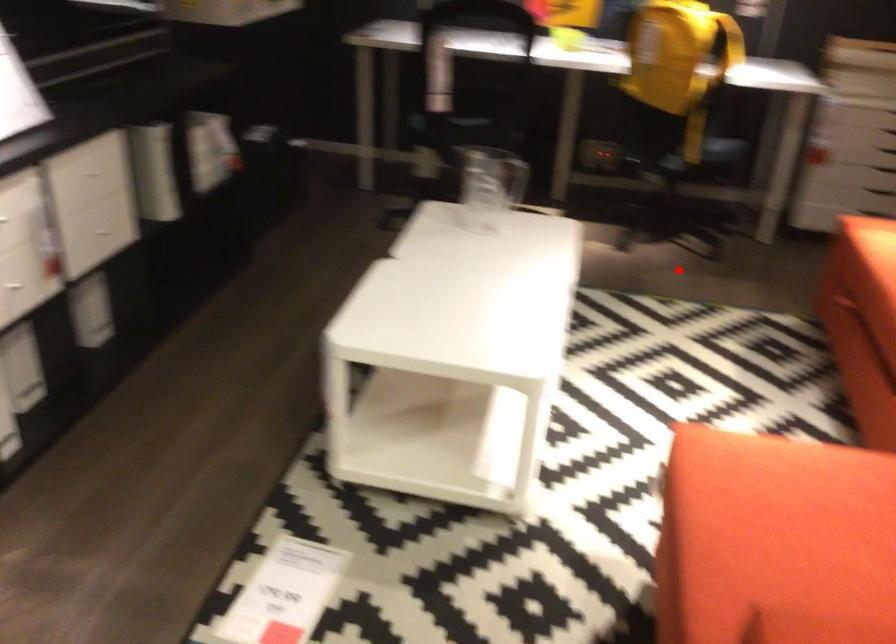
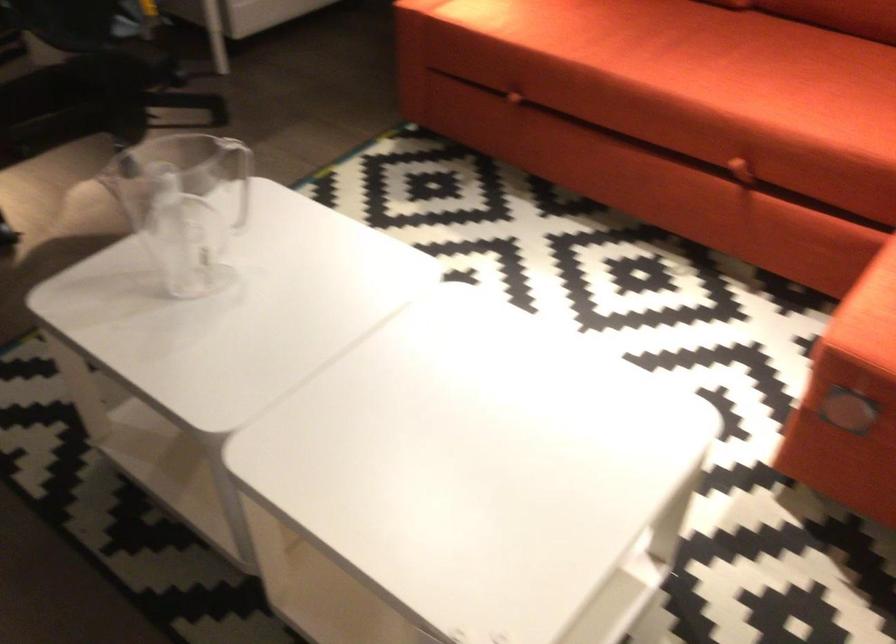
Question: I am providing you with two images of the same scene from different viewpoints. Given a red point in image1, look at the same physical point in image2. Is it:

Choices:
 (A) Closer to the viewpoint
 (B) Farther from the viewpoint

Answer: (A)